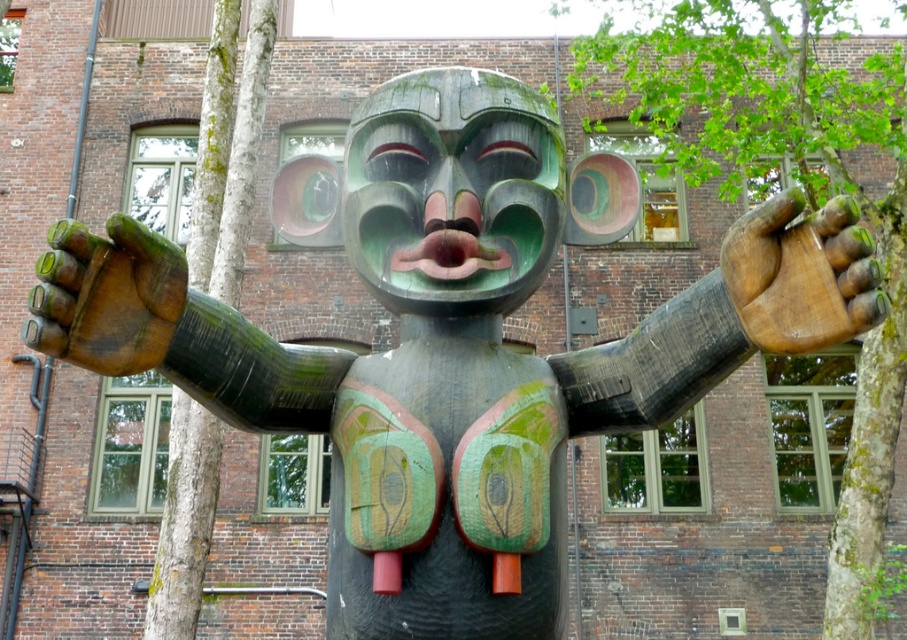
You are a park ranger measuring the distance between two trees in the park. The green mossy tree trunk at center and the green rough bark tree at left are in your sight. Can you fit a 10 meter long bench between them without moving any trees?

The distance between the green mossy tree trunk at center and the green rough bark tree at left is 8.41 meters. Since the bench is 10 meters long, it is longer than the space between the trees. Therefore, the bench cannot be placed between them without moving the trees.

You are standing in front of the totem pole and want to place a small decoration between the green mossy tree trunk at center and the metallic pipe at left. Based on their positions, which object should the decoration be closer to?

The decoration should be placed closer to the metallic pipe at left because the green mossy tree trunk at center is to the right of the metallic pipe at left.

You are standing in front of the totem pole and want to touch both points on it. Which point should you reach for first, point [211,416] or point [71,196]?

Result: You should reach for point [211,416] first because it is closer to you than point [71,196].